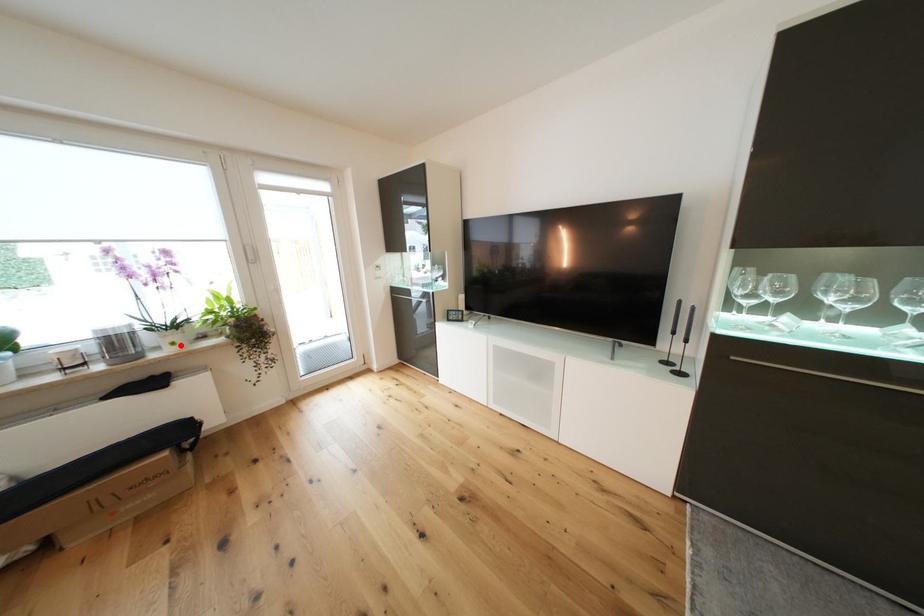
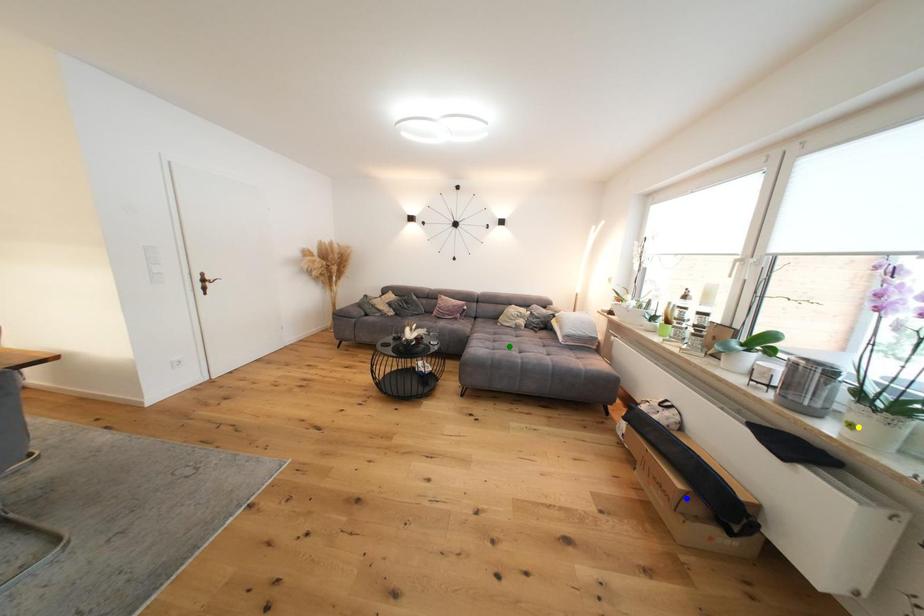
Question: I am providing you with two images of the same scene from different viewpoints. A red point is marked on the first image. You are given multiple points on the second image. Which mark in image 2 goes with the point in image 1?

Choices:
 (A) blue point
 (B) green point
 (C) yellow point

Answer: (C)